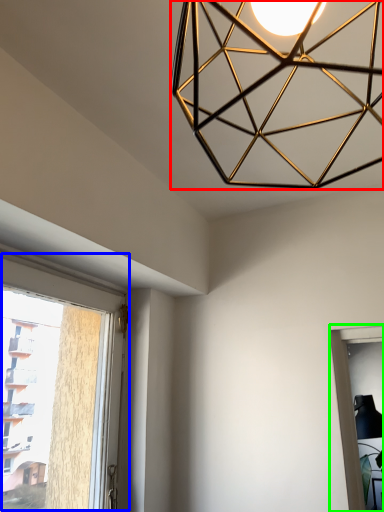
Question: Which object is the closest to the lamp (highlighted by a red box)? Choose among these: window (highlighted by a blue box) or window (highlighted by a green box).

Choices:
 (A) window
 (B) window

Answer: (A)